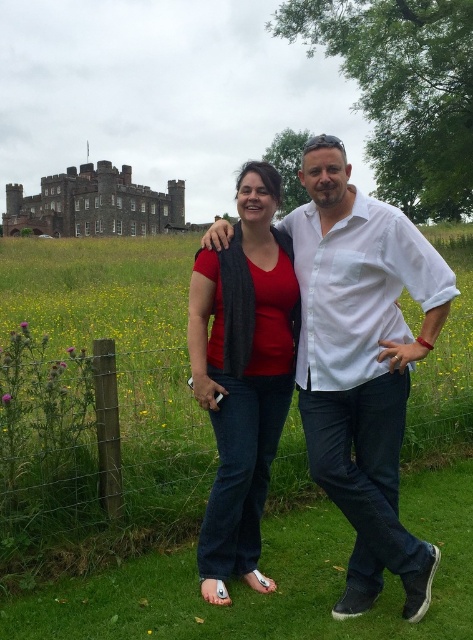
You are standing at the center of the grassy field in the image. You want to walk towards the wire mesh fence at lower center. What direction should you walk in?

Since the wire mesh fence at lower center is located at point 0.706 on the x axis and 0.205 on the y axis, you should walk towards the lower center direction to reach it.

You are a photographer trying to capture a photo of the two people in the scene. You notice the wire mesh fence at lower center and the white cotton shirt at center are both in your frame. Which object takes up more space in the photo?

The wire mesh fence at lower center takes up more space in the photo because it is bigger than the white cotton shirt at center.

You are taking a photo of the scene and want to focus on both the point at coordinates point (49, 372) and point (296, 307). Which point should you focus on first to ensure both are in sharp focus?

You should focus on point (49, 372) first because it is closer to the camera than point (296, 307), ensuring both points are within the depth of field.